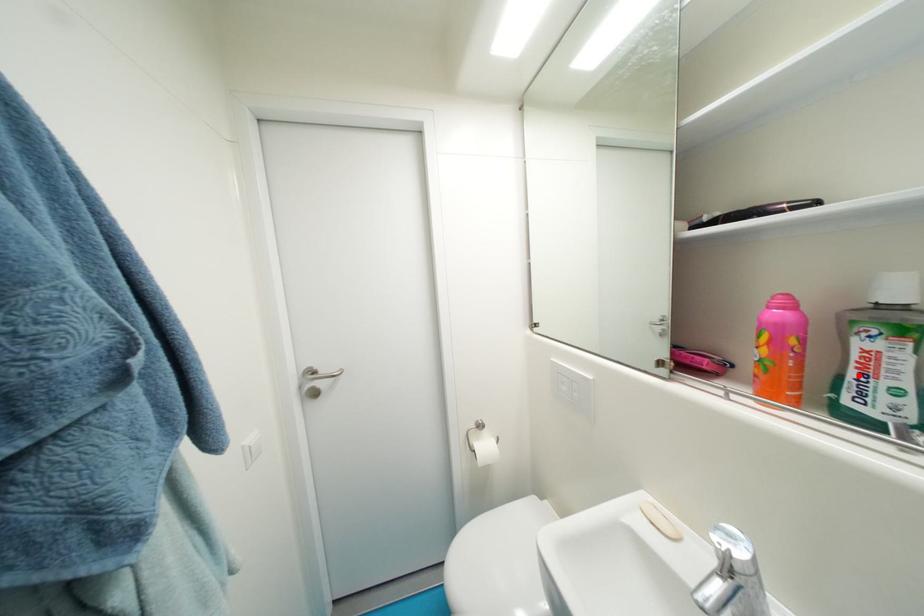
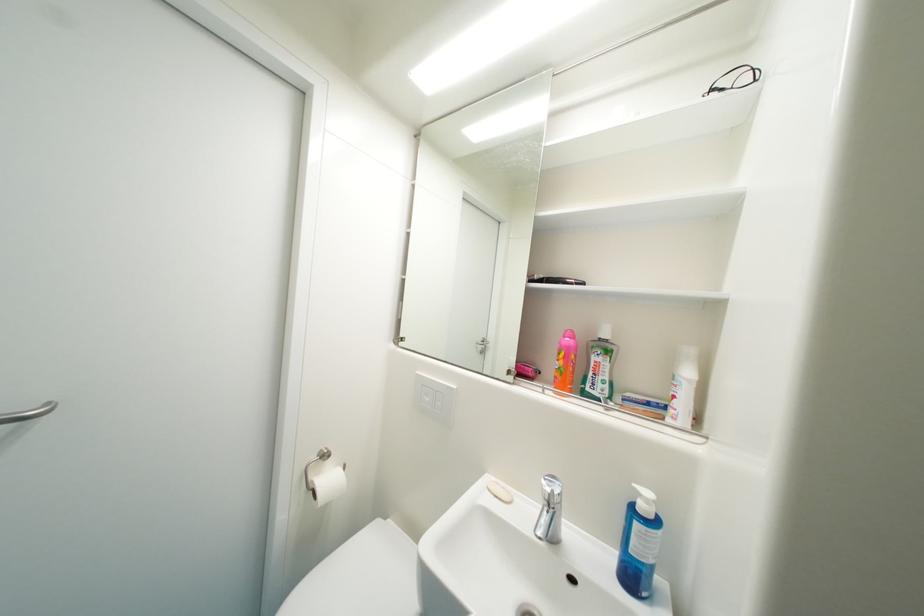
Where in the second image is the point corresponding to the highlighted location from the first image?

(598, 376)